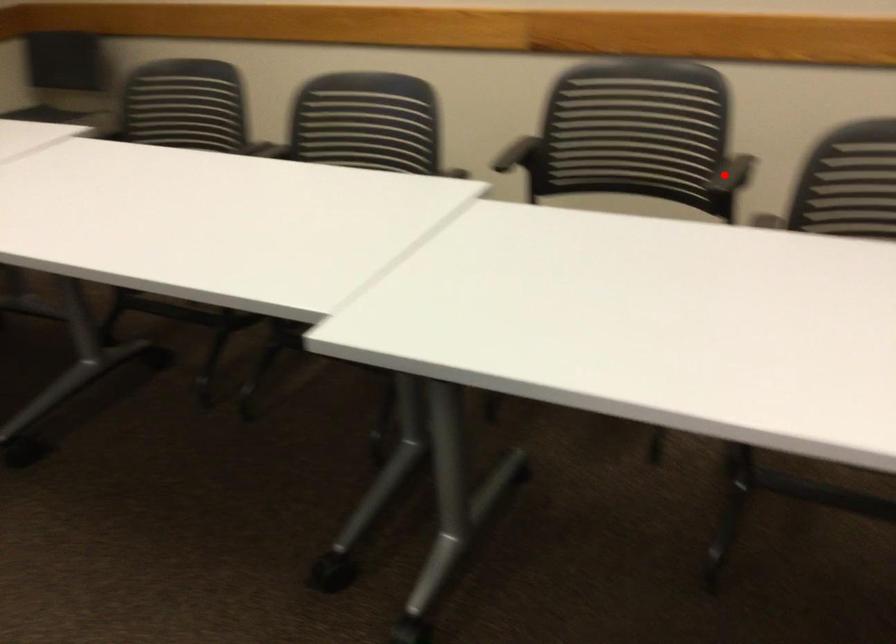
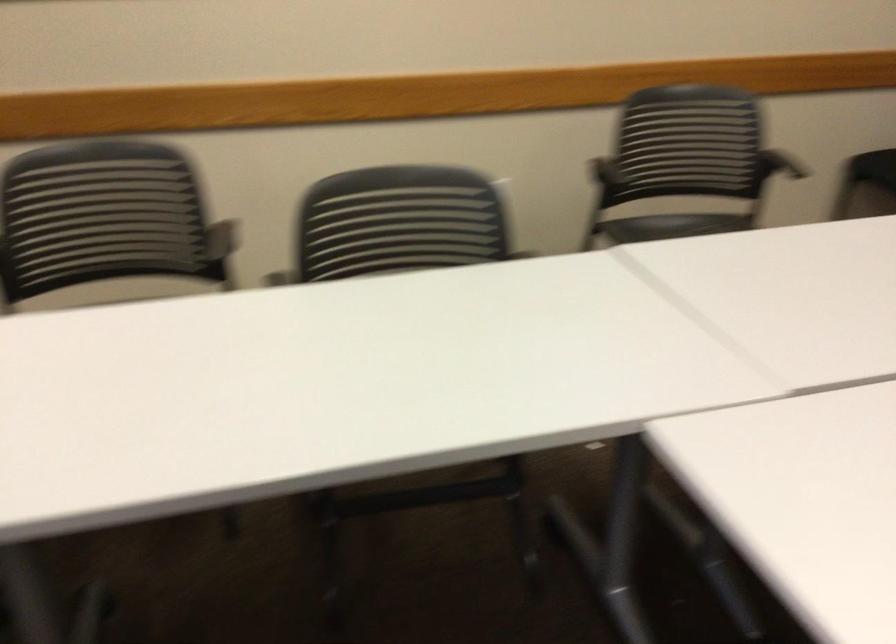
Question: I am providing you with two images of the same scene from different viewpoints. Given a red point in image1, look at the same physical point in image2. Is it:

Choices:
 (A) Closer to the viewpoint
 (B) Farther from the viewpoint

Answer: (B)